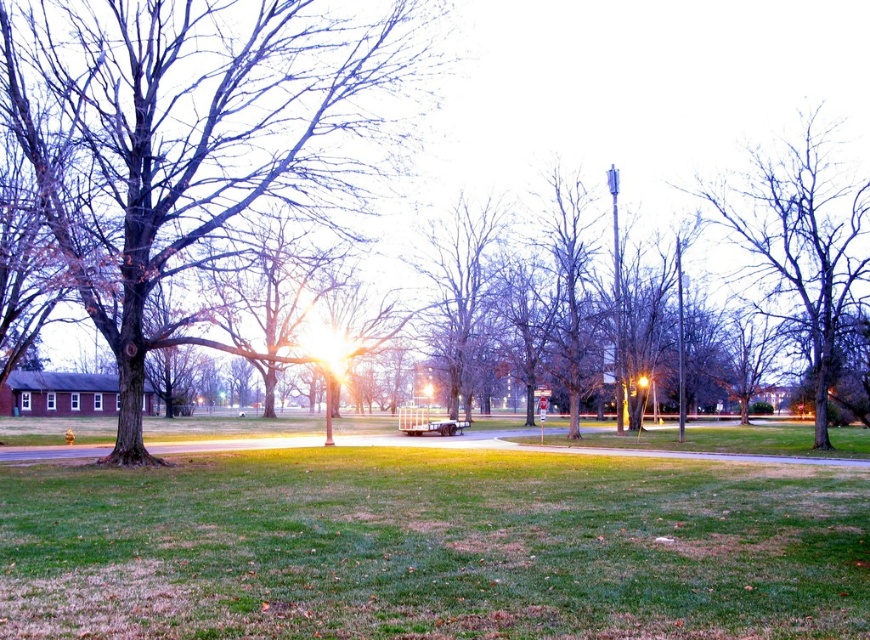
Is bare wood tree at left bigger than bare wood tree at center?

No.

Does point (125, 234) come farther from viewer compared to point (462, 321)?

No, it is in front of (462, 321).

Who is more distant from viewer, (x=77, y=58) or (x=430, y=330)?

The point (x=430, y=330) is more distant.

The image size is (870, 640). I want to click on bare wood tree at left, so click(x=192, y=134).

Is point (543, 604) farther from camera compared to point (464, 323)?

No, it is not.

Is point (135, 577) positioned in front of point (445, 321)?

Yes, point (135, 577) is in front of point (445, 321).

Identify the location of green grassy field at center. (432, 547).

Is green grassy field at center taller than bare wood tree at upper right?

In fact, green grassy field at center may be shorter than bare wood tree at upper right.

Who is more forward, (735, 582) or (808, 186)?

Positioned in front is point (735, 582).

Where is `green grassy field at center`? green grassy field at center is located at coordinates (432, 547).

Locate an element on the screen. green grassy field at center is located at coordinates (432, 547).